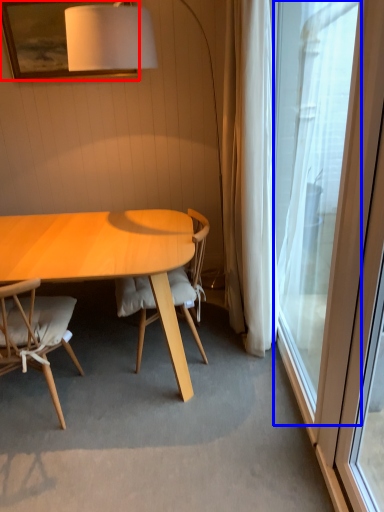
Question: Which object is further to the camera taking this photo, picture frame (highlighted by a red box) or window (highlighted by a blue box)?

Choices:
 (A) picture frame
 (B) window

Answer: (A)